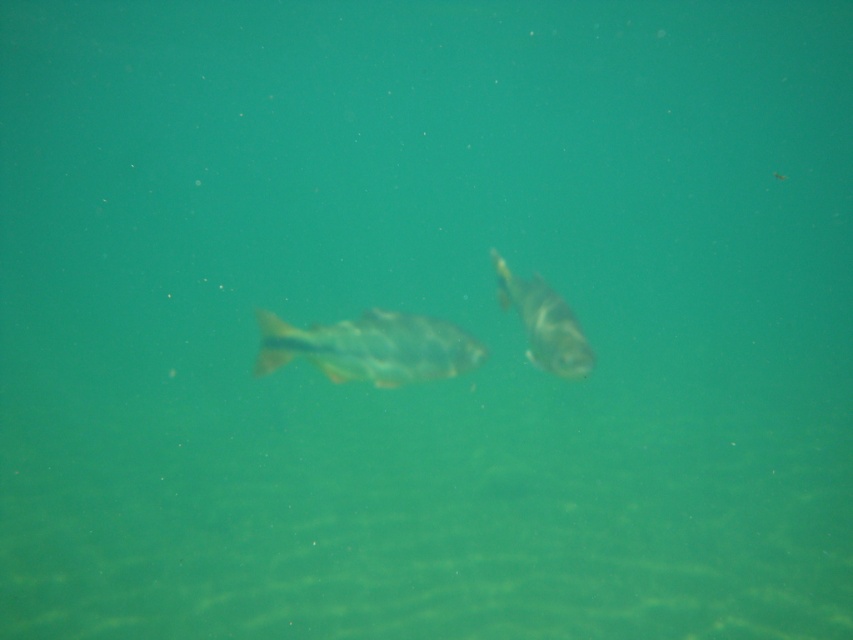
Who is more forward, (x=465, y=337) or (x=569, y=310)?

Point (x=569, y=310)

Which of these two, speckled silver fish at center or shiny silver fish at center, stands taller?

Standing taller between the two is shiny silver fish at center.

At what (x,y) coordinates should I click in order to perform the action: click on speckled silver fish at center. Please return your answer as a coordinate pair (x, y). Looking at the image, I should click on (370, 348).